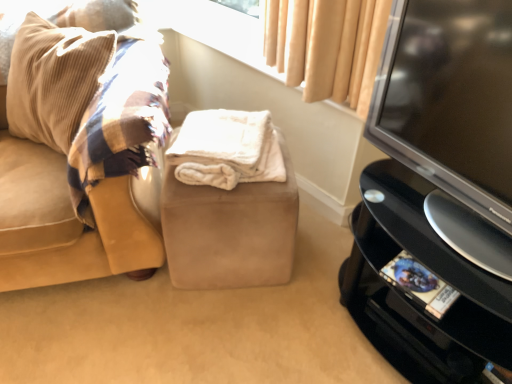
Find the location of a particular element. This screenshot has height=384, width=512. vacant region above black plastic tv stand at right (from a real-world perspective) is located at coordinates (437, 223).